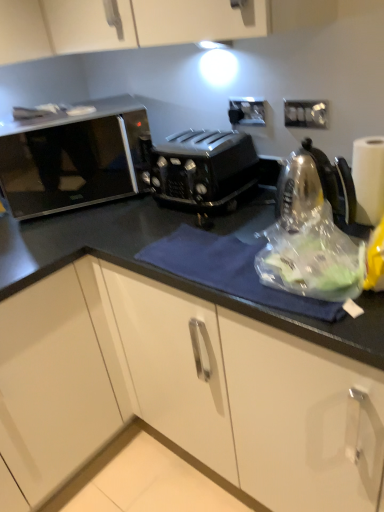
I want to click on empty space that is ontop of black plastic toaster at center (from a real-world perspective), so click(185, 141).